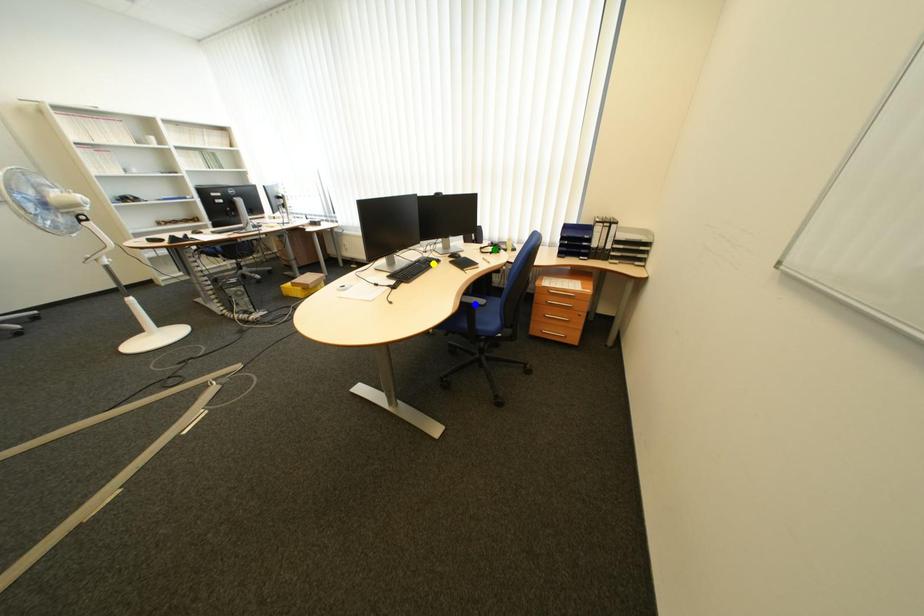
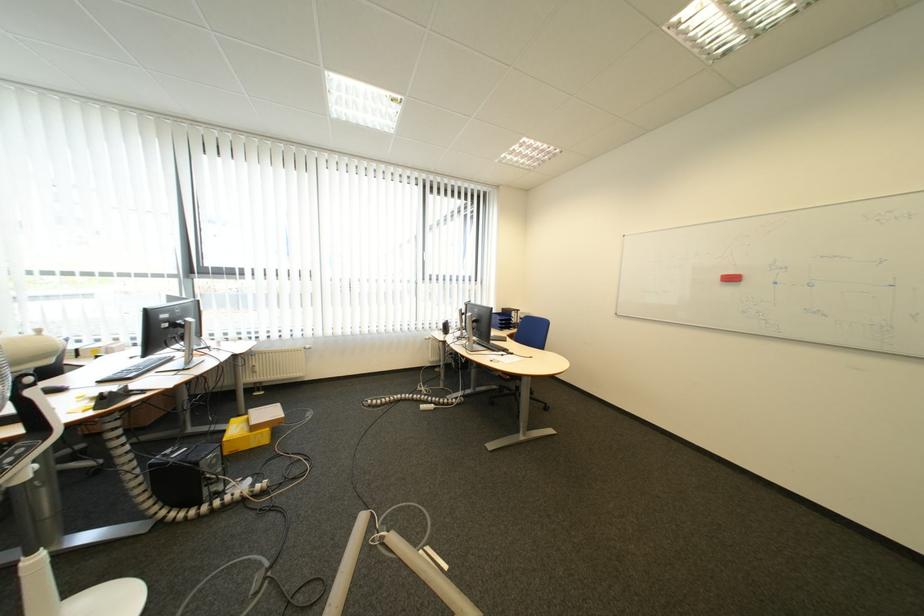
I am providing you with two images of the same scene from different viewpoints. Three points are marked in image1. Which point corresponds to a part or object that is occluded in image2?In image1, three points are marked. Which of them correspond to a part or object that is occluded in image2?Among the three points shown in image1, which one corresponds to a part or object that is no longer visible due to occlusion in image2?

Invisible in image2: yellow point, green point, blue point.